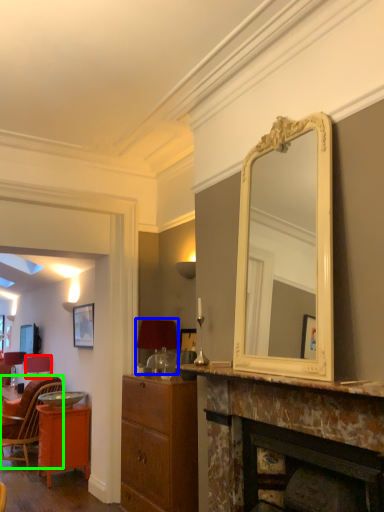
Question: Estimate the real-world distances between objects in this image. Which object is farther from lamp (highlighted by a red box), lamp (highlighted by a blue box) or chair (highlighted by a green box)?

Choices:
 (A) lamp
 (B) chair

Answer: (A)